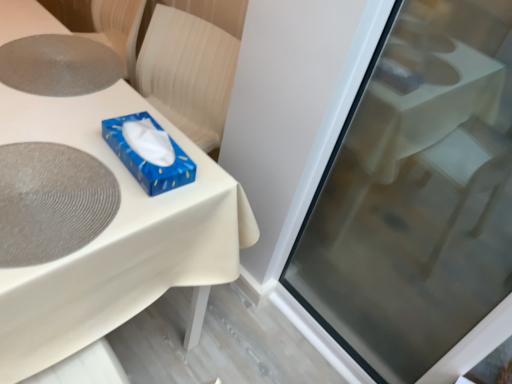
Question: Are white glossy table at center and blue glossy tissue box at upper center beside each other?

Choices:
 (A) yes
 (B) no

Answer: (B)

Question: Does white glossy table at center appear on the right side of blue glossy tissue box at upper center?

Choices:
 (A) no
 (B) yes

Answer: (A)

Question: Is white glossy table at center positioned in front of blue glossy tissue box at upper center?

Choices:
 (A) yes
 (B) no

Answer: (A)

Question: From the image's perspective, is white glossy table at center located above blue glossy tissue box at upper center?

Choices:
 (A) yes
 (B) no

Answer: (A)

Question: From a real-world perspective, is white glossy table at center positioned under blue glossy tissue box at upper center based on gravity?

Choices:
 (A) no
 (B) yes

Answer: (B)

Question: Would you consider white glossy table at center to be distant from blue glossy tissue box at upper center?

Choices:
 (A) yes
 (B) no

Answer: (B)

Question: Considering the relative sizes of gray textured placemat at upper left, which is the first oval from back to front, and white glossy table at center in the image provided, is gray textured placemat at upper left, which is the first oval from back to front, bigger than white glossy table at center?

Choices:
 (A) yes
 (B) no

Answer: (B)

Question: Is gray textured placemat at upper left, placed as the 2th oval when sorted from bottom to top, in front of white glossy table at center?

Choices:
 (A) no
 (B) yes

Answer: (A)

Question: From the image's perspective, is gray textured placemat at upper left, which is the first oval from back to front, under white glossy table at center?

Choices:
 (A) no
 (B) yes

Answer: (A)

Question: Considering the relative sizes of gray textured placemat at upper left, placed as the 2th oval when sorted from bottom to top, and white glossy table at center in the image provided, is gray textured placemat at upper left, placed as the 2th oval when sorted from bottom to top, shorter than white glossy table at center?

Choices:
 (A) yes
 (B) no

Answer: (A)

Question: Is gray textured placemat at upper left, placed as the 2th oval when sorted from bottom to top, facing away from white glossy table at center?

Choices:
 (A) no
 (B) yes

Answer: (B)

Question: Could you tell me if gray textured placemat at upper left, which is the second oval in front-to-back order, is facing white glossy table at center?

Choices:
 (A) no
 (B) yes

Answer: (B)

Question: Can you confirm if transparent glass screen door at upper right is smaller than gray textured placemat at upper left, which is the first oval from back to front?

Choices:
 (A) no
 (B) yes

Answer: (A)